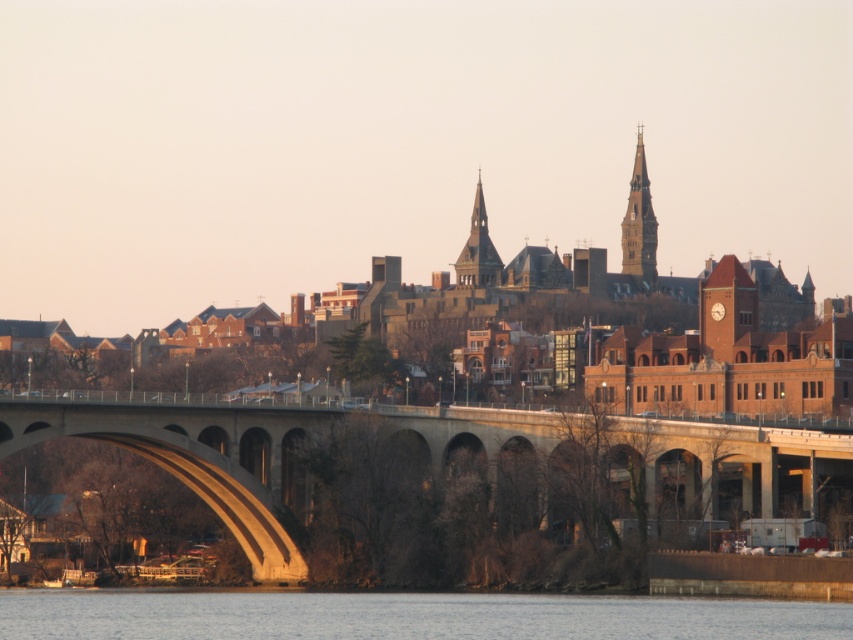
You are a city planner reviewing the city layout. You need to determine which structure occupies more space in the foreground. Based on the image, which one is larger in size between the concrete bridge at center and the smooth gray spire at center?

The concrete bridge at center is bigger than the smooth gray spire at center, so the concrete bridge at center occupies more space in the foreground.

You are standing on the sidewalk next to the smooth water at lower center and want to cross to the other side. The concrete bridge at center is your only option. Can you use it to cross the water?

The concrete bridge at center is positioned on the right side of smooth water at lower center, so yes, you can use the concrete bridge at center to cross the water.

You are a city planner analyzing the layout of this area. Given the coordinates provided for the concrete bridge at center, how does its position affect the flow of traffic in relation to the surrounding buildings?

The concrete bridge at center is located at point (426, 454), which places it centrally within the scene, likely directing traffic towards the dense cluster of buildings in the midground and the two prominent spires. This central positioning may facilitate efficient traffic flow towards key architectural landmarks and commercial areas.